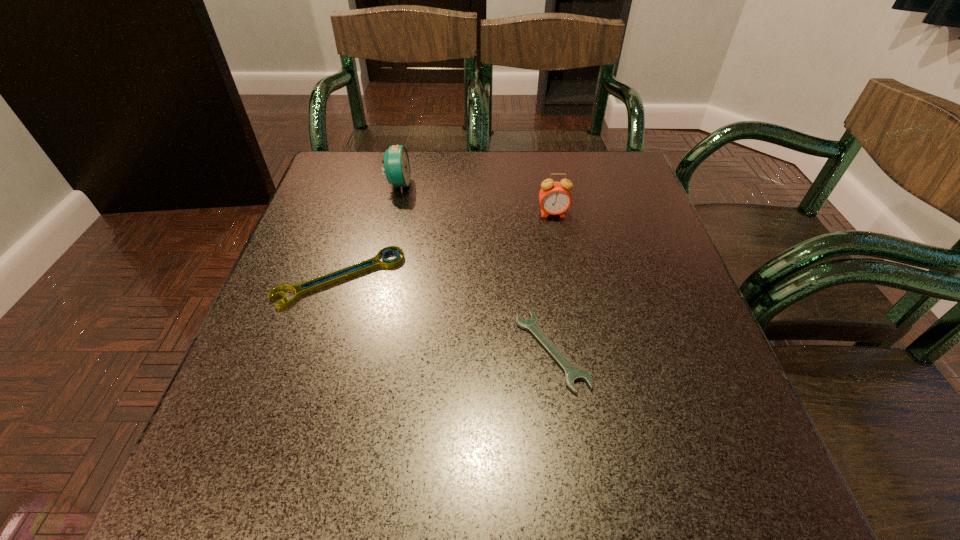
I want to click on free space between the farther alarm clock and the nearer wrench, so click(x=475, y=268).

Locate which object ranks third in proximity to the farther alarm clock. Please provide its 2D coordinates. Your answer should be formatted as a tuple, i.e. [(x, y)], where the tuple contains the x and y coordinates of a point satisfying the conditions above.

[(572, 374)]

Image resolution: width=960 pixels, height=540 pixels. I want to click on object that is the second closest to the left wrench, so point(572,374).

Identify the location of vacant region that satisfies the following two spatial constraints: 1. on the front-facing side of the left alarm clock; 2. on the back side of the right wrench. The image size is (960, 540). 361,351.

Find the location of `vacant area that satisfies the following two spatial constraints: 1. on the front-facing side of the farther alarm clock; 2. on the left side of the nearest object`. vacant area that satisfies the following two spatial constraints: 1. on the front-facing side of the farther alarm clock; 2. on the left side of the nearest object is located at coordinates (361, 351).

I want to click on free spot that satisfies the following two spatial constraints: 1. on the back side of the right wrench; 2. on the front-facing side of the farther alarm clock, so tap(529, 185).

Locate an element on the screen. This screenshot has height=540, width=960. free space that satisfies the following two spatial constraints: 1. on the front-facing side of the nearer wrench; 2. on the right side of the farther alarm clock is located at coordinates (361, 351).